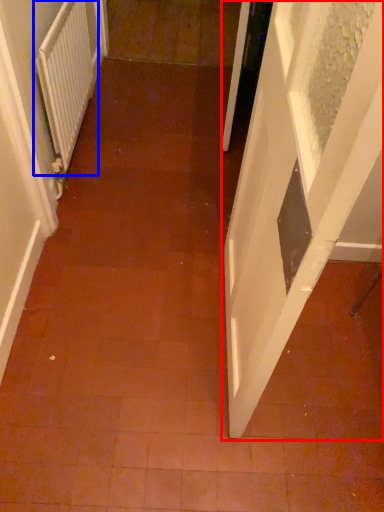
Question: Which object is further to the camera taking this photo, door (highlighted by a red box) or radiator (highlighted by a blue box)?

Choices:
 (A) door
 (B) radiator

Answer: (B)